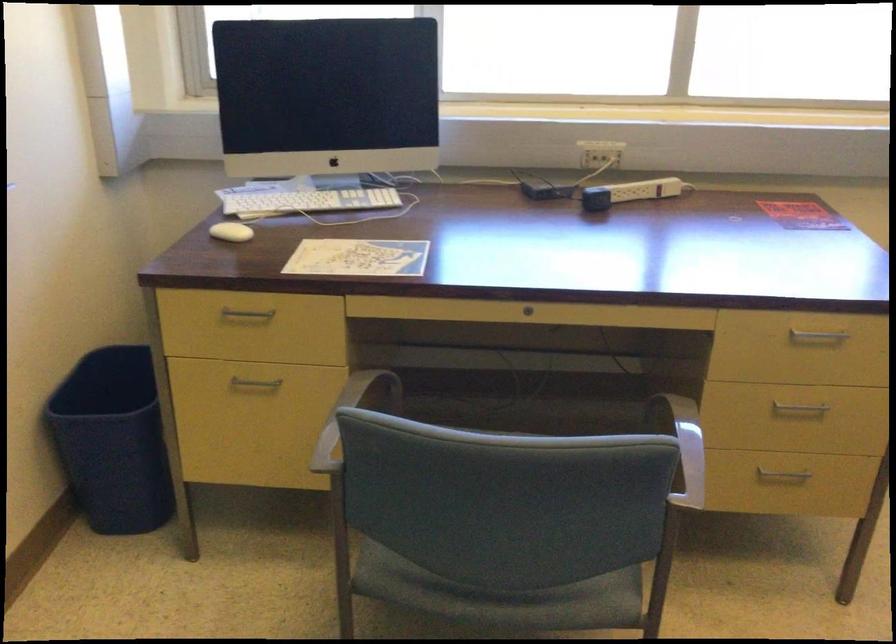
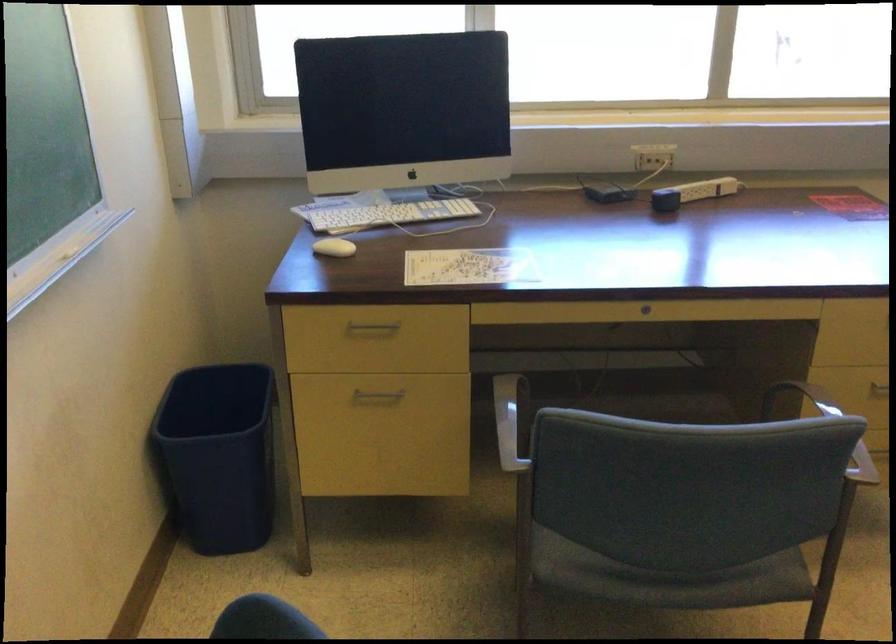
In the second image, find the point that corresponds to pixel 530 313 in the first image.

(645, 308)